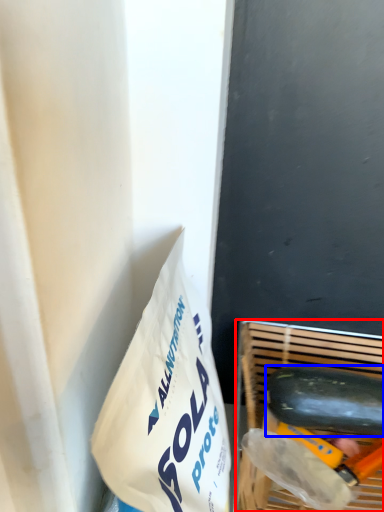
Question: Which object appears farthest to the camera in this image, basket (highlighted by a red box) or cucumber (highlighted by a blue box)?

Choices:
 (A) basket
 (B) cucumber

Answer: (B)